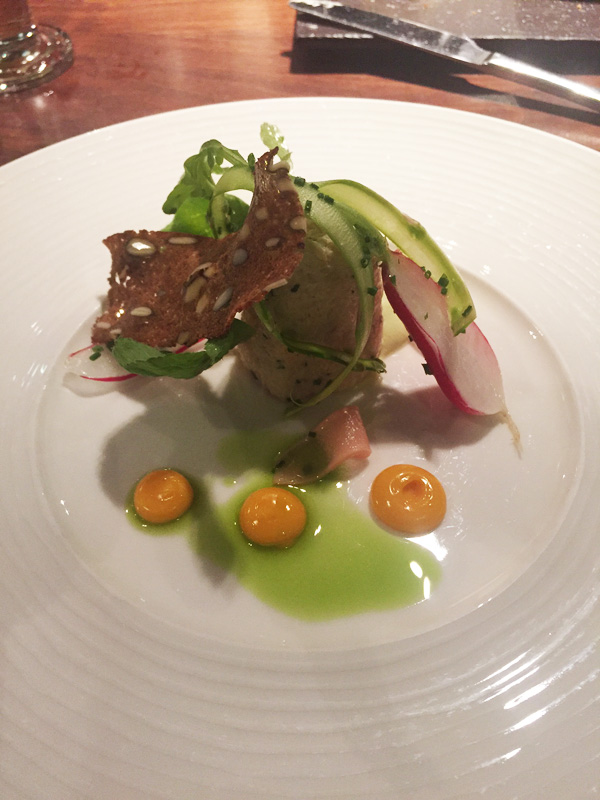
The height and width of the screenshot is (800, 600). What are the coordinates of `glass` in the screenshot? It's located at (49, 69).